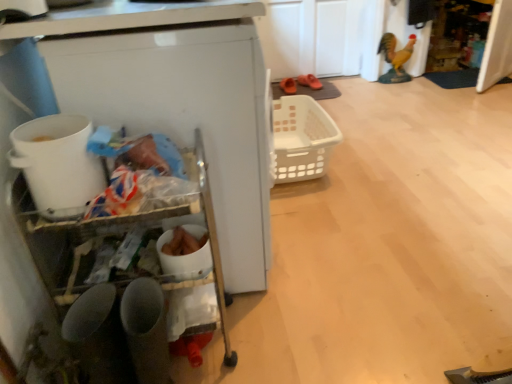
Question: Considering the positions of shiny gold statue at upper right and white plastic bucket at left in the image, is shiny gold statue at upper right wider or thinner than white plastic bucket at left?

Choices:
 (A) wide
 (B) thin

Answer: (B)

Question: In the image, is shiny gold statue at upper right on the left side or the right side of white plastic bucket at left?

Choices:
 (A) right
 (B) left

Answer: (A)

Question: Which of these objects is positioned closest to the white plastic bucket at left?

Choices:
 (A) orange rubber clogs at center, the 2th footwear positioned from the left
 (B) orange suede shoes at center, which is counted as the first footwear, starting from the left
 (C) white plastic basket at center
 (D) shiny gold statue at upper right

Answer: (C)

Question: Which object is the farthest from the orange suede shoes at center, which is counted as the first footwear, starting from the left?

Choices:
 (A) shiny gold statue at upper right
 (B) white plastic basket at center
 (C) white plastic bucket at left
 (D) orange rubber clogs at center, the 2th footwear positioned from the left

Answer: (C)